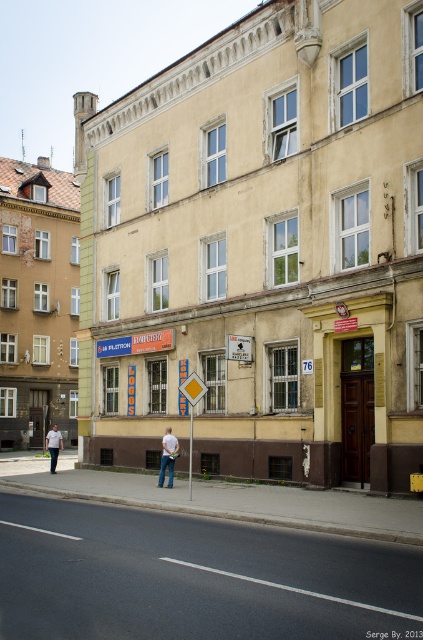
You are a photographer standing on the sidewalk in front of the building. You want to take a photo that includes both the Komputery sign and the Logus sign. The signs are located at point (247,339) and point (54,456) respectively. Which sign should you focus on first to ensure both are in clear view?

You should focus on point (247,339) first because it is closer to the camera than point (54,456), ensuring both signs are in clear view.

You are a delivery person with a large package that requires passing through the brown wooden door at center. The package is 1.2 meters wide. Can you fit through the door if the metallic rectangular sign at center is 1 meter wide?

The brown wooden door at center might be wider than metallic rectangular sign at center. Since the sign is 1 meter wide, the door could be wider than 1.2 meters, allowing the package to fit through.